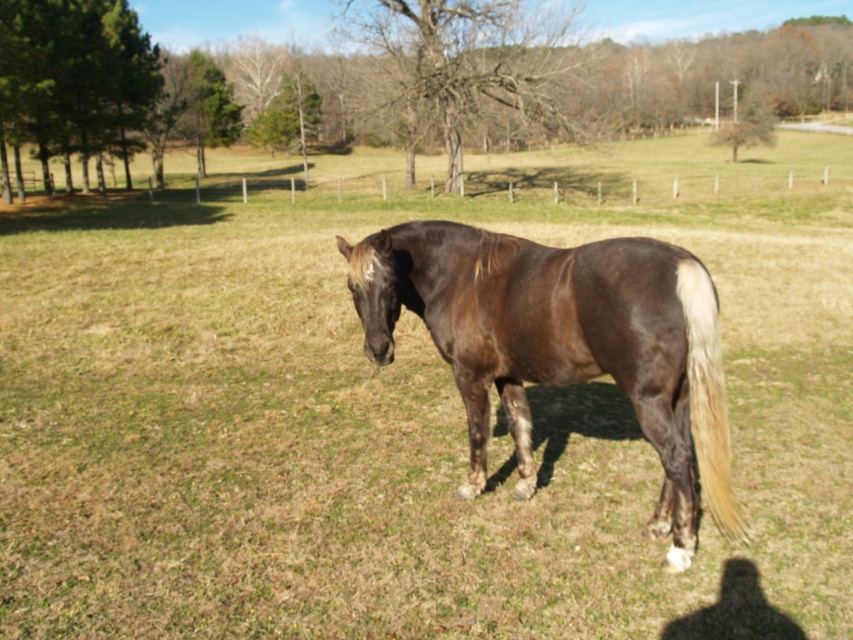
Question: Which point appears closest to the camera in this image?

Choices:
 (A) (614, 292)
 (B) (743, 520)

Answer: (A)

Question: Does brown glossy horse at center lie in front of white silky tail at right?

Choices:
 (A) yes
 (B) no

Answer: (B)

Question: Can you confirm if brown glossy horse at center is bigger than white silky tail at right?

Choices:
 (A) no
 (B) yes

Answer: (B)

Question: Does brown glossy horse at center appear over white silky tail at right?

Choices:
 (A) no
 (B) yes

Answer: (B)

Question: Which point is closer to the camera?

Choices:
 (A) (723, 524)
 (B) (728, 532)

Answer: (A)